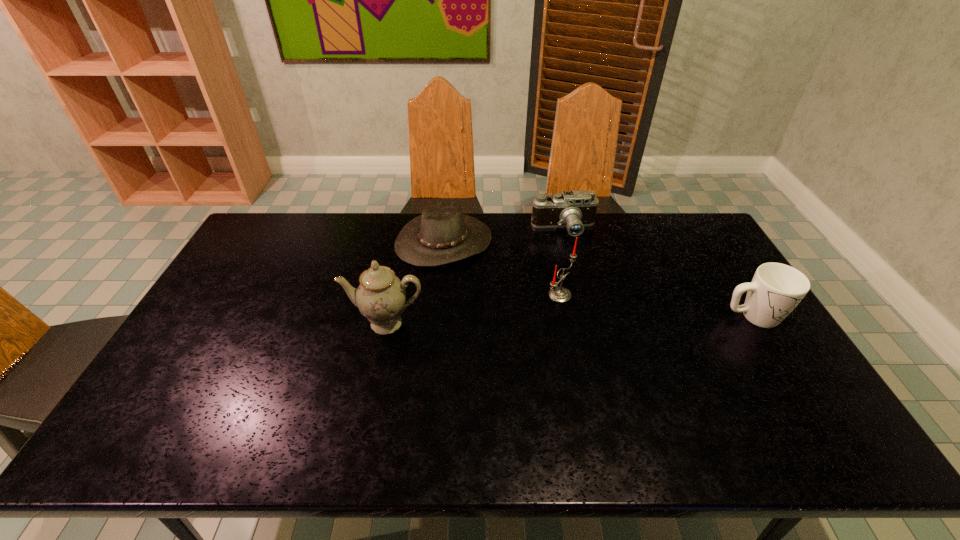
The image size is (960, 540). I want to click on vacant spot on the desktop that is between the chinaware and the rightmost object and is positioned at the lens of the camera, so click(x=575, y=320).

Identify the location of vacant space on the desktop that is between the tallest object and the rightmost object and is positioned on the front-facing side of the hat. This screenshot has width=960, height=540. (516, 321).

Image resolution: width=960 pixels, height=540 pixels. In order to click on free space on the desktop that is between the chinaware and the rightmost object and is positioned on the front-facing side of the candle in this screenshot , I will do `click(624, 319)`.